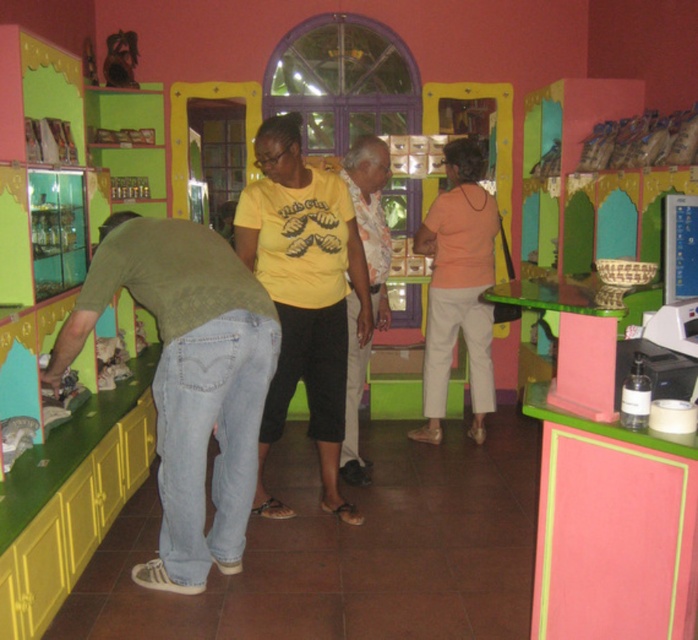
What is located at the coordinates point (304,296) in the image?

The point (304,296) corresponds to the yellow matte t shirt at center.